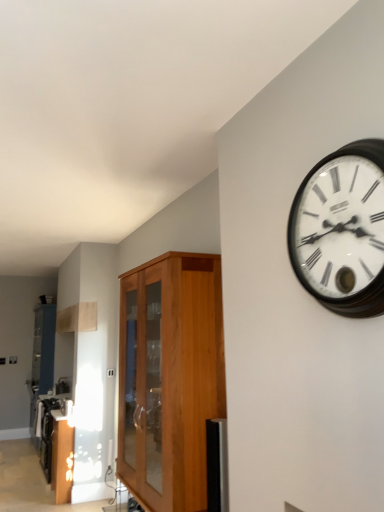
Question: From the image's perspective, is metallic stainless steel toaster at lower left located above wooden wall clock at upper right?

Choices:
 (A) no
 (B) yes

Answer: (A)

Question: Considering the relative sizes of metallic stainless steel toaster at lower left and wooden wall clock at upper right in the image provided, is metallic stainless steel toaster at lower left thinner than wooden wall clock at upper right?

Choices:
 (A) yes
 (B) no

Answer: (A)

Question: Is metallic stainless steel toaster at lower left positioned with its back to wooden wall clock at upper right?

Choices:
 (A) no
 (B) yes

Answer: (A)

Question: Would you say wooden wall clock at upper right is part of metallic stainless steel toaster at lower left's contents?

Choices:
 (A) yes
 (B) no

Answer: (B)

Question: From a real-world perspective, is metallic stainless steel toaster at lower left physically below wooden wall clock at upper right?

Choices:
 (A) no
 (B) yes

Answer: (B)

Question: Does metallic stainless steel toaster at lower left come in front of wooden wall clock at upper right?

Choices:
 (A) no
 (B) yes

Answer: (A)

Question: Is wooden cabinet at center closer to camera compared to metallic stainless steel toaster at lower left?

Choices:
 (A) yes
 (B) no

Answer: (A)

Question: Does wooden cabinet at center have a lesser height compared to metallic stainless steel toaster at lower left?

Choices:
 (A) yes
 (B) no

Answer: (B)

Question: Considering the relative sizes of wooden cabinet at center and metallic stainless steel toaster at lower left in the image provided, is wooden cabinet at center bigger than metallic stainless steel toaster at lower left?

Choices:
 (A) yes
 (B) no

Answer: (A)

Question: Is wooden cabinet at center facing away from metallic stainless steel toaster at lower left?

Choices:
 (A) no
 (B) yes

Answer: (A)

Question: From the image's perspective, would you say wooden cabinet at center is shown under metallic stainless steel toaster at lower left?

Choices:
 (A) no
 (B) yes

Answer: (A)

Question: From a real-world perspective, is wooden cabinet at center physically above metallic stainless steel toaster at lower left?

Choices:
 (A) no
 (B) yes

Answer: (B)

Question: Considering the relative sizes of wooden wall clock at upper right and metallic stainless steel toaster at lower left in the image provided, is wooden wall clock at upper right thinner than metallic stainless steel toaster at lower left?

Choices:
 (A) no
 (B) yes

Answer: (A)